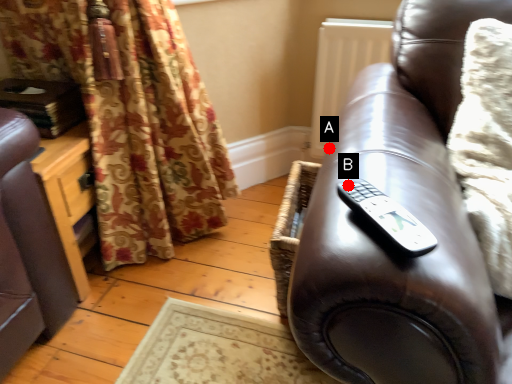
Question: Two points are circled on the image, labeled by A and B beside each circle. Which of the following is the closest to the observer?

Choices:
 (A) A is closer
 (B) B is closer

Answer: (B)